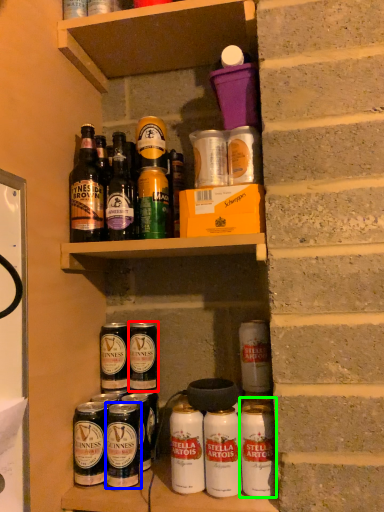
Question: Estimate the real-world distances between objects in this image. Which object is closer to beer (highlighted by a red box), beverage (highlighted by a blue box) or beer (highlighted by a green box)?

Choices:
 (A) beverage
 (B) beer

Answer: (A)